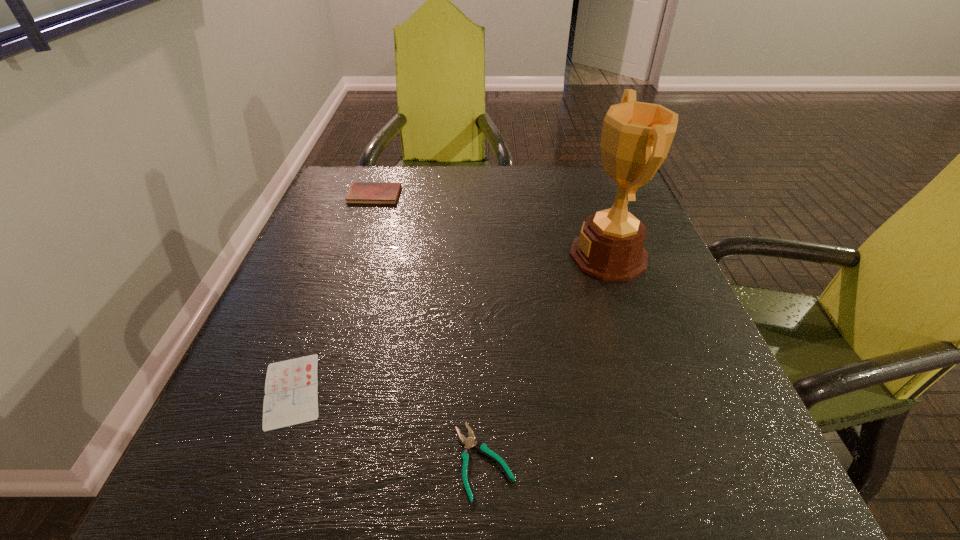
Image resolution: width=960 pixels, height=540 pixels. I want to click on free space located 0.210m on the right of the shorter diary, so click(x=456, y=390).

Locate an element on the screen. Image resolution: width=960 pixels, height=540 pixels. free space located on the left of the pliers is located at coordinates (355, 461).

Locate an element on the screen. object situated at the far edge is located at coordinates (360, 192).

I want to click on object located in the near edge section of the desktop, so click(469, 442).

You are a GUI agent. You are given a task and a screenshot of the screen. Output one action in this format:
    pyautogui.click(x=<x>, y=<y>)
    Task: Click on the object situated at the right edge
    
    Given the screenshot: What is the action you would take?
    pyautogui.click(x=636, y=137)

The height and width of the screenshot is (540, 960). In order to click on object positioned at the far left corner in this screenshot , I will do `click(360, 192)`.

This screenshot has height=540, width=960. In the image, there is a desktop. Identify the location of vacant region at the far edge. (556, 214).

Where is `vacant space at the near edge of the desktop`? Image resolution: width=960 pixels, height=540 pixels. vacant space at the near edge of the desktop is located at coordinates (395, 497).

In the image, there is a desktop. What are the coordinates of `vacant space at the left edge` in the screenshot? It's located at (261, 437).

Identify the location of vacant space at the right edge of the desktop. The height and width of the screenshot is (540, 960). (620, 359).